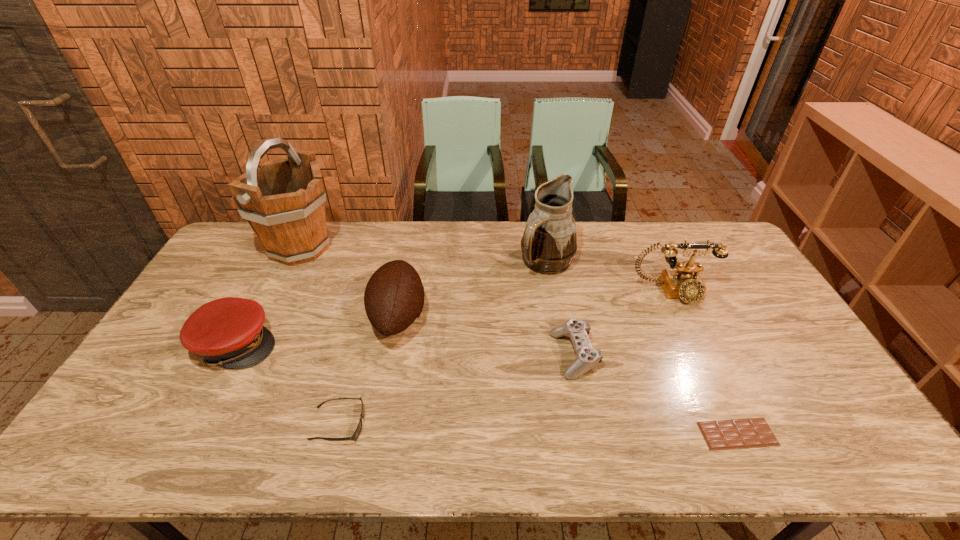
Image resolution: width=960 pixels, height=540 pixels. In the image, there is a desktop. What are the coordinates of `free space at the near right corner` in the screenshot? It's located at (856, 431).

Where is `vacant area that lies between the pitcher and the football`? Image resolution: width=960 pixels, height=540 pixels. vacant area that lies between the pitcher and the football is located at coordinates click(472, 289).

Identify the location of vacant space that's between the chocolate bar and the third shortest object. (656, 394).

Image resolution: width=960 pixels, height=540 pixels. Identify the location of empty space between the tallest object and the cap. coord(269,296).

You are a GUI agent. You are given a task and a screenshot of the screen. Output one action in this format:
    pyautogui.click(x=<x>, y=<y>)
    Task: Click on the vacant area that lies between the bucket and the second shortest object
    This screenshot has height=540, width=960.
    Given the screenshot: What is the action you would take?
    pyautogui.click(x=320, y=336)

Image resolution: width=960 pixels, height=540 pixels. In order to click on vacant area that lies between the football and the bucket in this screenshot , I will do `click(349, 282)`.

I want to click on vacant space that is in between the sunglasses and the pitcher, so click(443, 343).

Where is `unoccupied position between the chocolate bar and the cap`? unoccupied position between the chocolate bar and the cap is located at coordinates (487, 389).

The height and width of the screenshot is (540, 960). Identify the location of free space that is in between the second shortest object and the tallest object. point(320,336).

Identify the location of free space between the tallest object and the second shortest object. (320, 336).